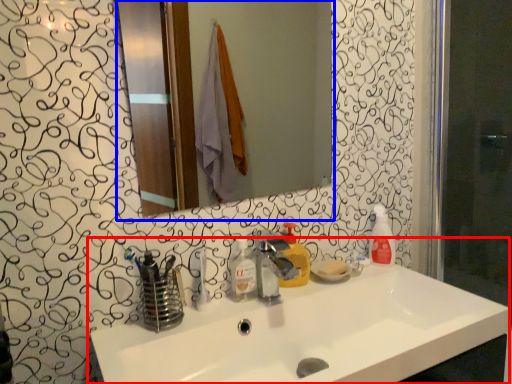
Question: Which object appears closest to the camera in this image, sink (highlighted by a red box) or mirror (highlighted by a blue box)?

Choices:
 (A) sink
 (B) mirror

Answer: (A)